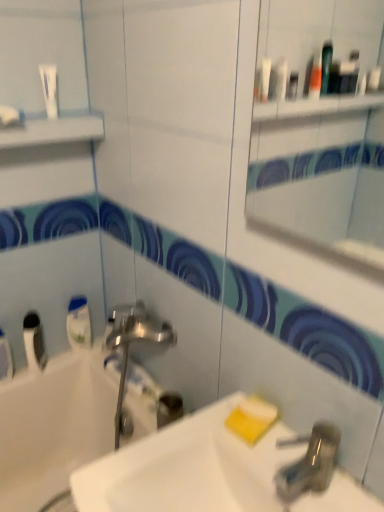
Locate an element on the screen. The image size is (384, 512). blank space to the left of metallic faucet at lower right is located at coordinates (222, 453).